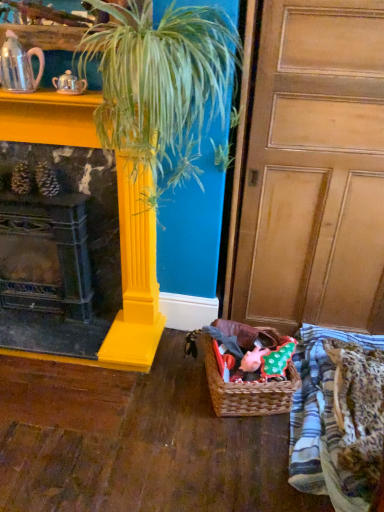
Question: Is fluffy leopard print blanket at lower right closer to camera compared to shiny silver teapot at upper left, the second tea pot viewed from the right?

Choices:
 (A) yes
 (B) no

Answer: (A)

Question: From the image's perspective, does fluffy leopard print blanket at lower right appear higher than shiny silver teapot at upper left, which ranks as the first tea pot in left-to-right order?

Choices:
 (A) yes
 (B) no

Answer: (B)

Question: Considering the relative sizes of fluffy leopard print blanket at lower right and shiny silver teapot at upper left, which ranks as the first tea pot in left-to-right order, in the image provided, is fluffy leopard print blanket at lower right taller than shiny silver teapot at upper left, which ranks as the first tea pot in left-to-right order,?

Choices:
 (A) yes
 (B) no

Answer: (B)

Question: Considering the relative sizes of fluffy leopard print blanket at lower right and shiny silver teapot at upper left, the second tea pot viewed from the right, in the image provided, is fluffy leopard print blanket at lower right shorter than shiny silver teapot at upper left, the second tea pot viewed from the right,?

Choices:
 (A) yes
 (B) no

Answer: (A)

Question: From the image's perspective, is fluffy leopard print blanket at lower right under shiny silver teapot at upper left, the second tea pot viewed from the right?

Choices:
 (A) yes
 (B) no

Answer: (A)

Question: Can you confirm if fluffy leopard print blanket at lower right is positioned to the right of shiny silver teapot at upper left, the second tea pot viewed from the right?

Choices:
 (A) yes
 (B) no

Answer: (A)

Question: From a real-world perspective, is matte yellow fireplace at left below brown woven basket at lower right?

Choices:
 (A) no
 (B) yes

Answer: (A)

Question: Is matte yellow fireplace at left positioned behind brown woven basket at lower right?

Choices:
 (A) yes
 (B) no

Answer: (B)

Question: Can you confirm if matte yellow fireplace at left is thinner than brown woven basket at lower right?

Choices:
 (A) no
 (B) yes

Answer: (B)

Question: Can you confirm if matte yellow fireplace at left is bigger than brown woven basket at lower right?

Choices:
 (A) no
 (B) yes

Answer: (B)

Question: Does matte yellow fireplace at left have a lesser height compared to brown woven basket at lower right?

Choices:
 (A) yes
 (B) no

Answer: (B)

Question: From a real-world perspective, is matte yellow fireplace at left positioned over brown woven basket at lower right based on gravity?

Choices:
 (A) no
 (B) yes

Answer: (B)

Question: Is pink glossy teapot at upper left, the first tea pot when ordered from right to left, closer to camera compared to yellow glossy column at center?

Choices:
 (A) yes
 (B) no

Answer: (B)